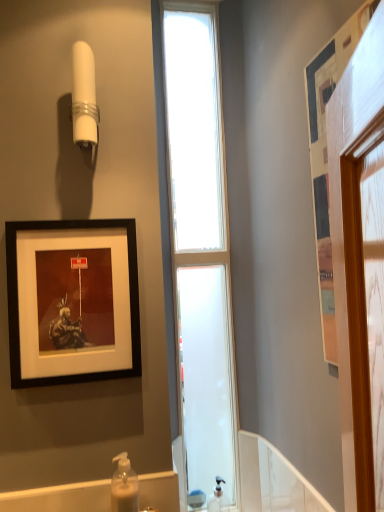
Question: From a real-world perspective, is clear glass window at center on top of white plastic shower at upper left?

Choices:
 (A) yes
 (B) no

Answer: (B)

Question: Is the depth of clear glass window at center greater than that of white plastic shower at upper left?

Choices:
 (A) yes
 (B) no

Answer: (A)

Question: Can you confirm if clear glass window at center is shorter than white plastic shower at upper left?

Choices:
 (A) yes
 (B) no

Answer: (B)

Question: Can you confirm if clear glass window at center is bigger than white plastic shower at upper left?

Choices:
 (A) yes
 (B) no

Answer: (A)

Question: Can you confirm if clear glass window at center is thinner than white plastic shower at upper left?

Choices:
 (A) no
 (B) yes

Answer: (B)

Question: From the image's perspective, is clear glass window at center located above white plastic shower at upper left?

Choices:
 (A) no
 (B) yes

Answer: (A)

Question: Is white plastic shower at upper left further to the viewer compared to clear plastic soap dispenser at lower center, which is counted as the second soap dispenser, starting from the top?

Choices:
 (A) yes
 (B) no

Answer: (B)

Question: Can we say white plastic shower at upper left lies outside clear plastic soap dispenser at lower center, arranged as the first soap dispenser when viewed from the right?

Choices:
 (A) yes
 (B) no

Answer: (A)

Question: Is white plastic shower at upper left positioned far away from clear plastic soap dispenser at lower center, the first soap dispenser from the bottom?

Choices:
 (A) yes
 (B) no

Answer: (A)

Question: Is white plastic shower at upper left to the left of clear plastic soap dispenser at lower center, positioned as the second soap dispenser in front-to-back order, from the viewer's perspective?

Choices:
 (A) no
 (B) yes

Answer: (B)

Question: Is white plastic shower at upper left shorter than clear plastic soap dispenser at lower center, the first soap dispenser from the bottom?

Choices:
 (A) yes
 (B) no

Answer: (B)

Question: From the image's perspective, does white plastic shower at upper left appear higher than clear plastic soap dispenser at lower center, the 1th soap dispenser when ordered from back to front?

Choices:
 (A) yes
 (B) no

Answer: (A)

Question: Is translucent plastic soap dispenser at lower center, arranged as the 2th soap dispenser when viewed from the back, outside of clear plastic soap dispenser at lower center, arranged as the first soap dispenser when viewed from the right?

Choices:
 (A) yes
 (B) no

Answer: (A)